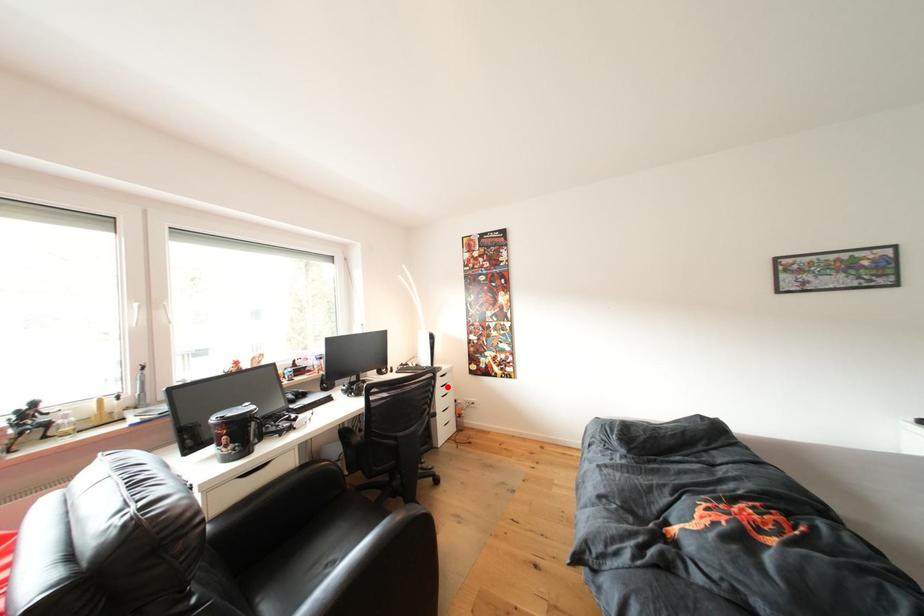
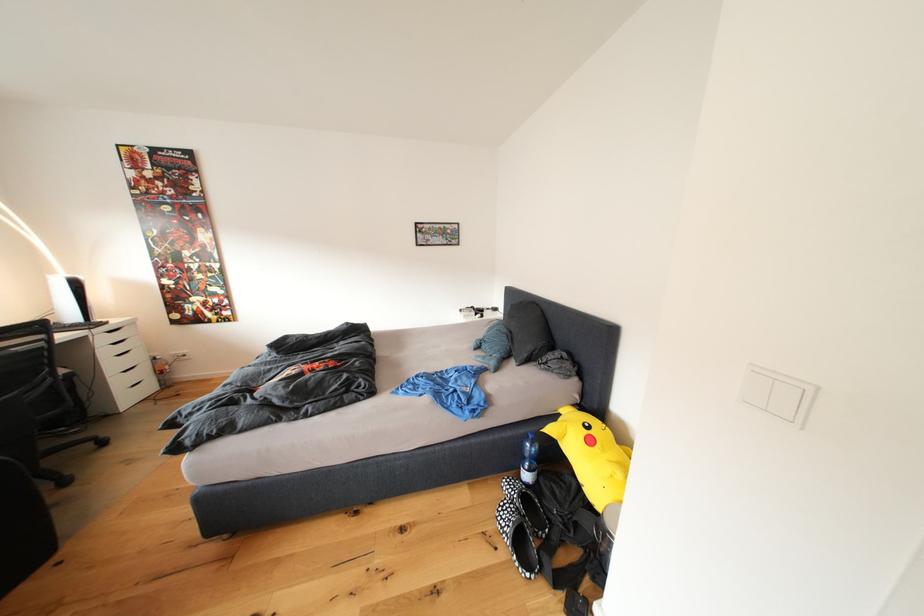
In the second image, find the point that corresponds to the highlighted location in the first image.

(111, 344)